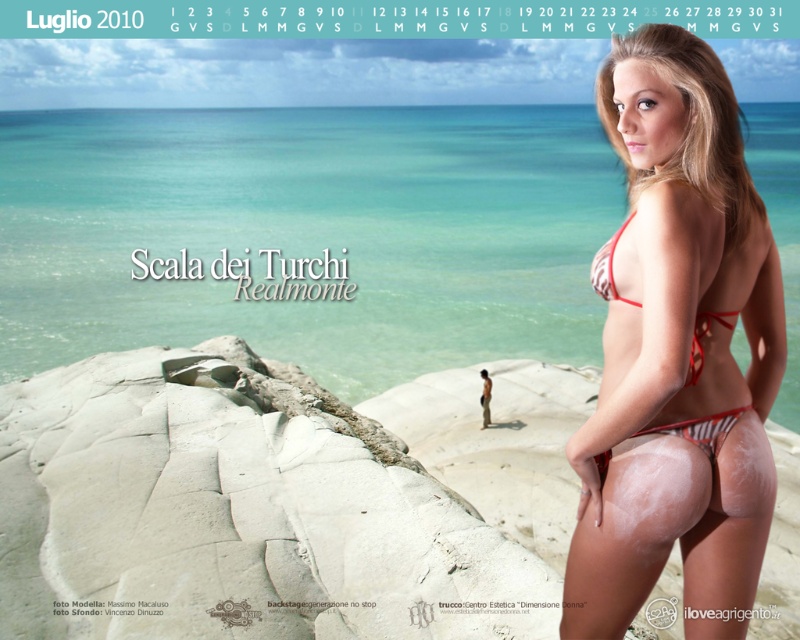
Question: Which object is closer to the camera taking this photo?

Choices:
 (A) red bikini at right
 (B) red striped bikini at right
 (C) transparent water at center

Answer: (A)

Question: Is transparent water at center to the left of red striped bikini at right from the viewer's perspective?

Choices:
 (A) no
 (B) yes

Answer: (B)

Question: Is red bikini at right thinner than red striped bikini at right?

Choices:
 (A) yes
 (B) no

Answer: (B)

Question: Observing the image, what is the correct spatial positioning of transparent water at center in reference to red striped bikini at right?

Choices:
 (A) left
 (B) right

Answer: (A)

Question: Which point is farther to the camera?

Choices:
 (A) (717, 492)
 (B) (722, 312)
 (C) (460, 125)

Answer: (C)

Question: Which point is farther to the camera?

Choices:
 (A) transparent water at center
 (B) red bikini at right

Answer: (A)